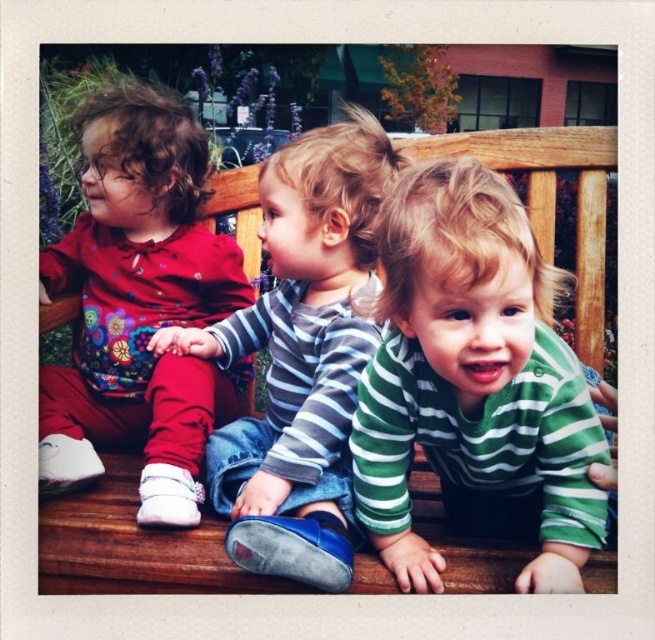
Does green striped shirt at center have a lesser width compared to matte floral shirt at left?

Correct, green striped shirt at center's width is less than matte floral shirt at left's.

Is point (508, 237) closer to viewer compared to point (185, 458)?

Yes, point (508, 237) is in front of point (185, 458).

Image resolution: width=655 pixels, height=640 pixels. I want to click on green striped shirt at center, so (474, 378).

Image resolution: width=655 pixels, height=640 pixels. What do you see at coordinates (140, 305) in the screenshot?
I see `matte floral shirt at left` at bounding box center [140, 305].

Where is `matte floral shirt at left`? This screenshot has height=640, width=655. matte floral shirt at left is located at coordinates (140, 305).

Identify the location of matte floral shirt at left. (140, 305).

Between green striped shirt at center and striped cotton shirt at center, which one appears on the right side from the viewer's perspective?

green striped shirt at center is more to the right.

Between point (591, 538) and point (290, 177), which one is positioned in front?

Positioned in front is point (591, 538).

Is point (424, 556) less distant than point (217, 337)?

Yes, point (424, 556) is in front of point (217, 337).

Identify the location of green striped shirt at center. (474, 378).